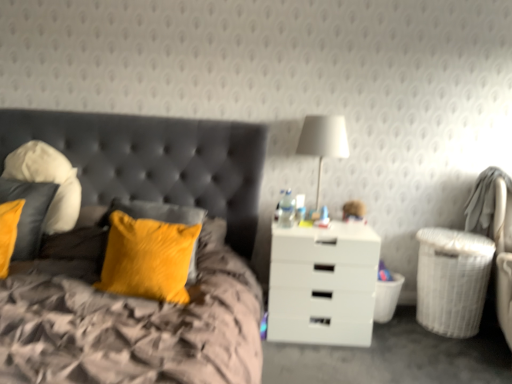
Question: Is white wicker laundry basket at lower right, positioned as the 2th laundry basket in left-to-right order, bigger or smaller than soft white pillow at left, the 1th pillow positioned from the left?

Choices:
 (A) big
 (B) small

Answer: (A)

Question: In the image, is white wicker laundry basket at lower right, positioned as the 2th laundry basket in left-to-right order, on the left side or the right side of soft white pillow at left, the 1th pillow positioned from the left?

Choices:
 (A) left
 (B) right

Answer: (B)

Question: Considering the real-world distances, which object is farthest from the velvet yellow pillow at center-left, which is counted as the 3th pillow, starting from the left?

Choices:
 (A) soft white pillow at left, which is counted as the third pillow, starting from the right
 (B) white glossy nightstand at center
 (C) velvet yellow pillow at left, which is the 2th pillow from right to left
 (D) velvet yellow pillow at upper left
 (E) white wicker laundry basket at right, placed as the first laundry basket when sorted from left to right

Answer: (E)

Question: Which is nearer to the white glossy nightstand at center?

Choices:
 (A) white wicker laundry basket at lower right, positioned as the 2th laundry basket in left-to-right order
 (B) white woven swivel chair at right
 (C) velvet yellow pillow at center-left, which is counted as the 3th pillow, starting from the left
 (D) white matte lampshade at upper right
 (E) soft white pillow at left, the 1th pillow positioned from the left

Answer: (A)